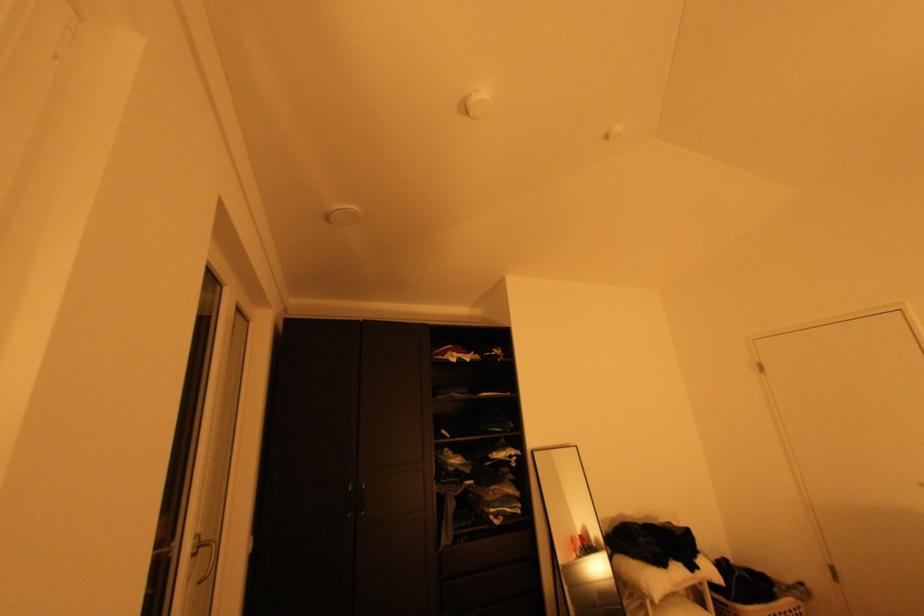
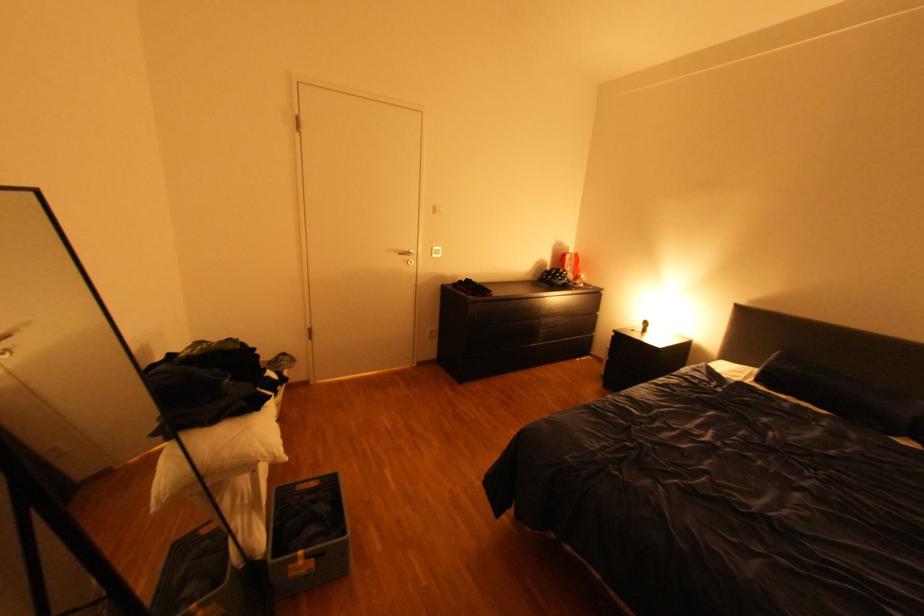
Find the pixel in the second image that matches pixel 643 557 in the first image.

(223, 421)